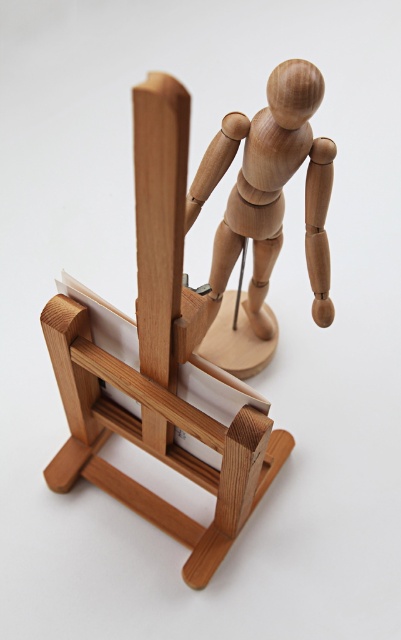
You are standing in front of an art installation and see the natural wood mannequin at center. If you want to touch the mannequin, will you need to move closer than 2 feet?

The natural wood mannequin at center is 21.21 inches away from the viewer. Since 21.21 inches is approximately 1.77 feet, which is less than 2 feet, you are already within the 2 feet distance and can touch it without moving closer.

You are an artist who wants to place a small sculpture between the natural wood mannequin at center and the natural wood mannequin at upper center. Which mannequin should the sculpture be closer to if you want it to appear proportionally balanced?

The natural wood mannequin at center is bigger than the natural wood mannequin at upper center. To achieve proportional balance, the sculpture should be placed closer to the smaller natural wood mannequin at upper center to compensate for its size difference.

You are an artist who wants to place a new canvas on the easel in front of the natural wood mannequin at center. Based on the mannequin position at point 0.484, 0.486, can you determine if the easel is positioned to the left or right of the mannequin?

The natural wood mannequin at center is located at point [194,308]. Since the easel is described as being in front of the mannequin, it would be positioned directly in front of the mannequin, not to the left or right.